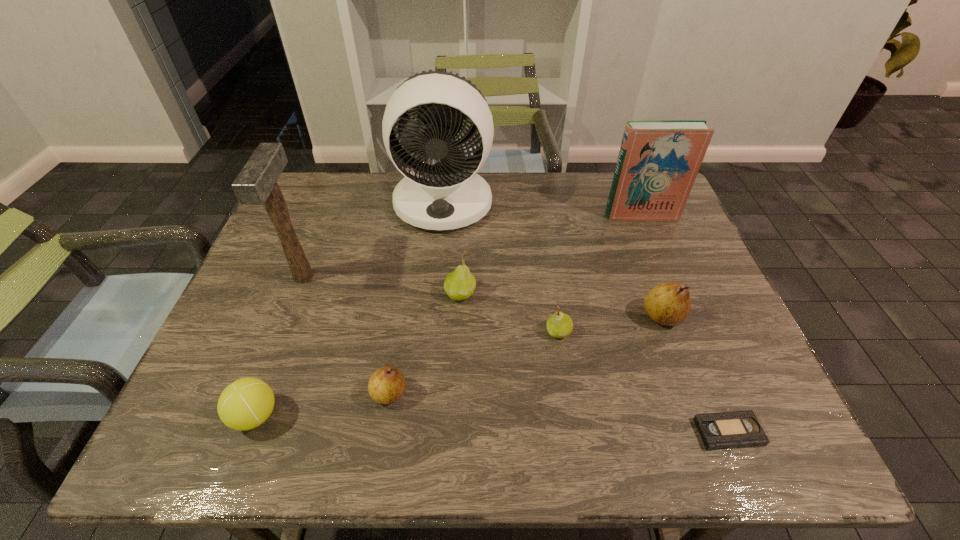
Image resolution: width=960 pixels, height=540 pixels. I want to click on the leftmost pear, so click(x=386, y=385).

At what (x,y) coordinates should I click in order to perform the action: click on green tennis ball. Please return your answer as a coordinate pair (x, y). The image size is (960, 540). Looking at the image, I should click on (245, 404).

In order to click on the shortest object in this screenshot , I will do `click(738, 429)`.

Find the location of `vacant space located on the grille of the fan`. vacant space located on the grille of the fan is located at coordinates (436, 284).

Locate an element on the screen. vacant space located on the right of the mallet is located at coordinates (449, 277).

At what (x,y) coordinates should I click in order to perform the action: click on vacant space located 0.160m on the cover of the hardback book. Please return your answer as a coordinate pair (x, y). Looking at the image, I should click on (659, 259).

Find the location of a particular element. The image size is (960, 540). vacant space located on the back of the farther brown pear is located at coordinates (630, 228).

Locate an element on the screen. vacant region located 0.340m on the back of the third pear from right to left is located at coordinates (465, 202).

At what (x,y) coordinates should I click in order to perform the action: click on blank space located 0.340m on the right of the right green pear. Please return your answer as a coordinate pair (x, y). Image resolution: width=960 pixels, height=540 pixels. Looking at the image, I should click on (719, 332).

Identify the location of free spot located on the right of the nearer brown pear. The height and width of the screenshot is (540, 960). (529, 393).